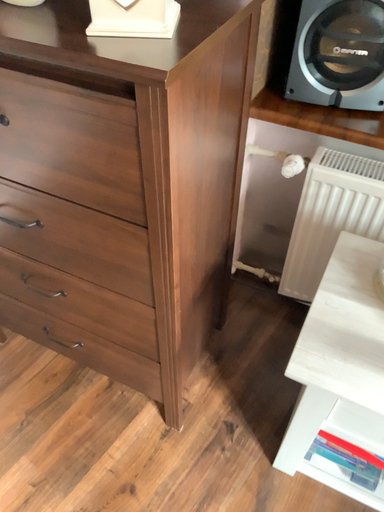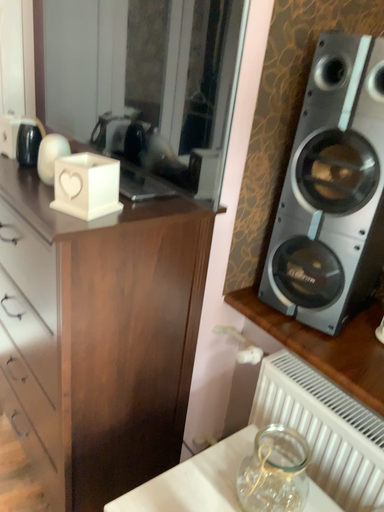
Question: Which way did the camera rotate in the video?

Choices:
 (A) rotated left
 (B) rotated right

Answer: (A)